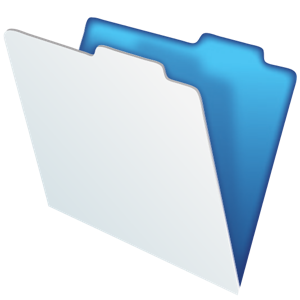
Locate an element on the screen. Image resolution: width=300 pixels, height=300 pixels. rounded corner is located at coordinates (161, 65), (97, 47), (261, 48), (202, 34).